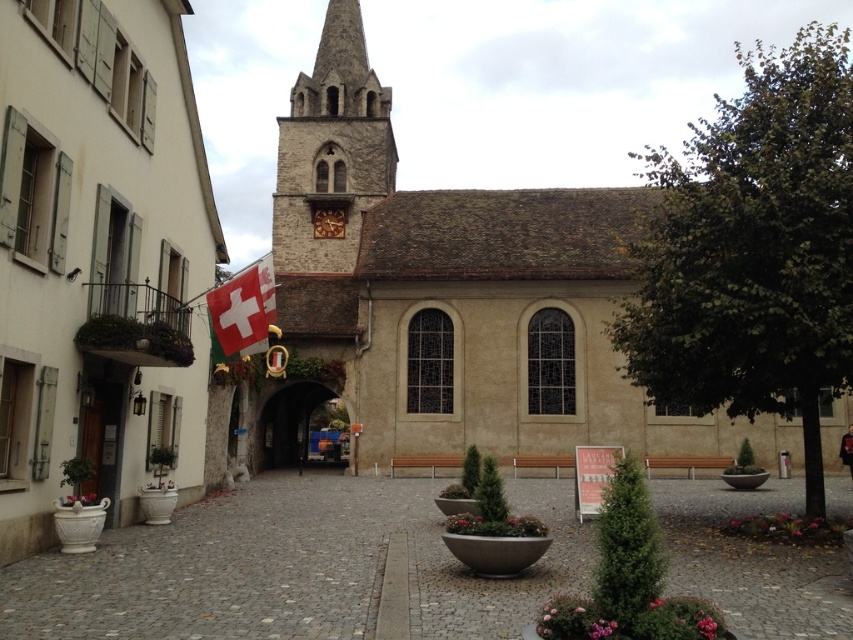
Does gray cobblestone alley at center appear over stone clock tower at center?

Incorrect, gray cobblestone alley at center is not positioned above stone clock tower at center.

Who is lower down, gray cobblestone alley at center or stone clock tower at center?

gray cobblestone alley at center is lower down.

Measure the distance between point (251, 627) and camera.

79.47 feet

At what (x,y) coordinates should I click in order to perform the action: click on gray cobblestone alley at center. Please return your answer as a coordinate pair (x, y). The height and width of the screenshot is (640, 853). Looking at the image, I should click on (293, 566).

Is stone clock tower at center positioned before white fabric flag at lower left?

No, it is not.

Locate an element on the screen. This screenshot has height=640, width=853. stone clock tower at center is located at coordinates (331, 150).

Where is `stone clock tower at center`? Image resolution: width=853 pixels, height=640 pixels. stone clock tower at center is located at coordinates (331, 150).

Does beige stone church at center have a larger size compared to stone clock tower at center?

Yes.

Which is more to the left, beige stone church at center or stone clock tower at center?

From the viewer's perspective, stone clock tower at center appears more on the left side.

Measure the distance between point (537, 296) and camera.

The distance of point (537, 296) from camera is 72.03 meters.

At what (x,y) coordinates should I click in order to perform the action: click on beige stone church at center. Please return your answer as a coordinate pair (x, y). The image size is (853, 640). Looking at the image, I should click on (451, 296).